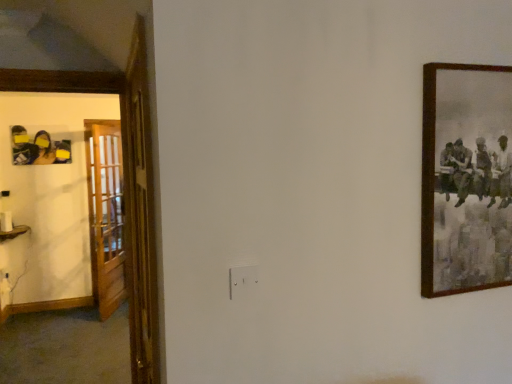
Describe the element at coordinates (106, 214) in the screenshot. I see `wooden at left, which is the 2th door from front to back` at that location.

Describe the element at coordinates (140, 213) in the screenshot. I see `wooden door at left, which is counted as the first door, starting from the right` at that location.

Describe the element at coordinates (38, 148) in the screenshot. I see `matte black photo frame at left` at that location.

This screenshot has width=512, height=384. I want to click on wooden at left, the 1th door positioned from the back, so click(106, 214).

Which object is more forward, wooden at left, the 1th door positioned from the back, or wooden door at left, which is counted as the first door, starting from the right?

wooden door at left, which is counted as the first door, starting from the right.

Is wooden at left, which is the 2th door from front to back, oriented towards wooden door at left, which is counted as the first door, starting from the right?

No, wooden at left, which is the 2th door from front to back, does not turn towards wooden door at left, which is counted as the first door, starting from the right.

Can you confirm if wooden at left, acting as the 2th door starting from the right, is taller than wooden door at left, marked as the second door in a back-to-front arrangement?

Indeed, wooden at left, acting as the 2th door starting from the right, has a greater height compared to wooden door at left, marked as the second door in a back-to-front arrangement.

What's the angular difference between wooden at left, the first door positioned from the left, and wooden door at left, marked as the second door in a back-to-front arrangement,'s facing directions?

wooden at left, the first door positioned from the left, and wooden door at left, marked as the second door in a back-to-front arrangement, are facing 137 degrees away from each other.

Considering the positions of objects wooden picture frame at right and wooden at left, the first door positioned from the left, in the image provided, who is more to the left, wooden picture frame at right or wooden at left, the first door positioned from the left,?

Positioned to the left is wooden at left, the first door positioned from the left.

From the image's perspective, is wooden picture frame at right above wooden at left, acting as the 2th door starting from the right?

Yes, from the image's perspective, wooden picture frame at right is above wooden at left, acting as the 2th door starting from the right.

In the scene shown: Which point is more distant from viewer, (x=499, y=103) or (x=122, y=200)?

Point (x=122, y=200)

Could you measure the distance between wooden picture frame at right and wooden at left, the first door positioned from the left?

12.28 feet.

In the image, is matte black photo frame at left positioned in front of or behind wooden at left, the 1th door positioned from the back?

matte black photo frame at left is behind wooden at left, the 1th door positioned from the back.

Which point is more distant from viewer, (39, 136) or (86, 137)?

The point (86, 137) is more distant.

There is a wooden at left, acting as the 2th door starting from the right. In order to click on art above it (from a real-world perspective) in this screenshot , I will do `click(38, 148)`.

Considering the sizes of matte black photo frame at left and wooden at left, acting as the 2th door starting from the right, in the image, is matte black photo frame at left bigger or smaller than wooden at left, acting as the 2th door starting from the right,?

matte black photo frame at left is smaller than wooden at left, acting as the 2th door starting from the right.

Considering the sizes of objects wooden at left, the 1th door positioned from the back, and wooden picture frame at right in the image provided, who is thinner, wooden at left, the 1th door positioned from the back, or wooden picture frame at right?

wooden at left, the 1th door positioned from the back.

From a real-world perspective, who is located lower, wooden at left, which is the 2th door from front to back, or wooden picture frame at right?

wooden at left, which is the 2th door from front to back.

Where is `the 2nd door directly beneath the wooden picture frame at right (from a real-world perspective)`? the 2nd door directly beneath the wooden picture frame at right (from a real-world perspective) is located at coordinates (106, 214).

Considering the relative positions of wooden at left, acting as the 2th door starting from the right, and wooden picture frame at right in the image provided, is wooden at left, acting as the 2th door starting from the right, to the left of wooden picture frame at right from the viewer's perspective?

Indeed, wooden at left, acting as the 2th door starting from the right, is positioned on the left side of wooden picture frame at right.

This screenshot has width=512, height=384. Identify the location of the 1st door located beneath the matte black photo frame at left (from a real-world perspective). pos(140,213).

Which object is further away from the camera taking this photo, wooden door at left, marked as the 2th door in a left-to-right arrangement, or matte black photo frame at left?

matte black photo frame at left is more distant.

From a real-world perspective, between wooden door at left, which is counted as the first door, starting from the right, and matte black photo frame at left, who is vertically higher?

In real-world perspective, matte black photo frame at left is above.

Is wooden picture frame at right positioned far away from wooden door at left, marked as the 2th door in a left-to-right arrangement?

That's right, there is a large distance between wooden picture frame at right and wooden door at left, marked as the 2th door in a left-to-right arrangement.

From the image's perspective, is wooden picture frame at right below wooden door at left, marked as the second door in a back-to-front arrangement?

No.

Is wooden picture frame at right to the left of wooden door at left, placed as the 1th door when sorted from front to back, from the viewer's perspective?

Incorrect, wooden picture frame at right is not on the left side of wooden door at left, placed as the 1th door when sorted from front to back.

Which is farther from the camera, (x=437, y=76) or (x=150, y=246)?

The point (x=150, y=246) is behind.

Is wooden picture frame at right beside matte black photo frame at left?

No, wooden picture frame at right is not touching matte black photo frame at left.

Considering the sizes of wooden picture frame at right and matte black photo frame at left in the image, is wooden picture frame at right bigger or smaller than matte black photo frame at left?

Clearly, wooden picture frame at right is larger in size than matte black photo frame at left.

Is wooden picture frame at right closer to camera compared to matte black photo frame at left?

Yes, it is.

Find the location of `picture frame in front of the matte black photo frame at left`. picture frame in front of the matte black photo frame at left is located at coordinates (466, 178).

At what (x,y) coordinates should I click in order to perform the action: click on door that is on the right side of wooden at left, the 1th door positioned from the back. Please return your answer as a coordinate pair (x, y). Image resolution: width=512 pixels, height=384 pixels. Looking at the image, I should click on (140, 213).

In order to click on picture frame above the wooden at left, the first door positioned from the left (from a real-world perspective) in this screenshot , I will do click(466, 178).

Consider the image. From the image, which object appears to be farther from wooden picture frame at right, matte black photo frame at left or wooden at left, the first door positioned from the left?

matte black photo frame at left lies further to wooden picture frame at right than the other object.

Which object lies further to the anchor point matte black photo frame at left, wooden door at left, which is counted as the first door, starting from the right, or wooden at left, acting as the 2th door starting from the right?

Among the two, wooden door at left, which is counted as the first door, starting from the right, is located further to matte black photo frame at left.

Which object lies nearer to the anchor point wooden door at left, placed as the 1th door when sorted from front to back, wooden picture frame at right or wooden at left, which is the 2th door from front to back?

The object closer to wooden door at left, placed as the 1th door when sorted from front to back, is wooden picture frame at right.

When comparing their distances from wooden at left, which is the 2th door from front to back, does wooden picture frame at right or matte black photo frame at left seem further?

The object further to wooden at left, which is the 2th door from front to back, is wooden picture frame at right.

When comparing their distances from wooden picture frame at right, does wooden at left, acting as the 2th door starting from the right, or matte black photo frame at left seem closer?

Based on the image, wooden at left, acting as the 2th door starting from the right, appears to be nearer to wooden picture frame at right.

Based on their spatial positions, is wooden picture frame at right or matte black photo frame at left closer to wooden door at left, which is counted as the first door, starting from the right?

wooden picture frame at right is positioned closer to the anchor wooden door at left, which is counted as the first door, starting from the right.

Estimate the real-world distances between objects in this image. Which object is closer to wooden picture frame at right, matte black photo frame at left or wooden door at left, marked as the second door in a back-to-front arrangement?

Based on the image, wooden door at left, marked as the second door in a back-to-front arrangement, appears to be nearer to wooden picture frame at right.

In the scene shown: Which object lies nearer to the anchor point wooden door at left, placed as the 1th door when sorted from front to back, wooden at left, acting as the 2th door starting from the right, or wooden picture frame at right?

wooden picture frame at right is positioned closer to the anchor wooden door at left, placed as the 1th door when sorted from front to back.

The width and height of the screenshot is (512, 384). I want to click on picture frame between wooden door at left, which is counted as the first door, starting from the right, and wooden at left, the 1th door positioned from the back, along the z-axis, so click(x=466, y=178).

This screenshot has height=384, width=512. Identify the location of door between wooden door at left, which is counted as the first door, starting from the right, and matte black photo frame at left, along the z-axis. (106, 214).

The width and height of the screenshot is (512, 384). In order to click on door between wooden picture frame at right and matte black photo frame at left from front to back in this screenshot , I will do `click(106, 214)`.

Locate an element on the screen. picture frame positioned between wooden door at left, marked as the 2th door in a left-to-right arrangement, and matte black photo frame at left from near to far is located at coordinates (466, 178).